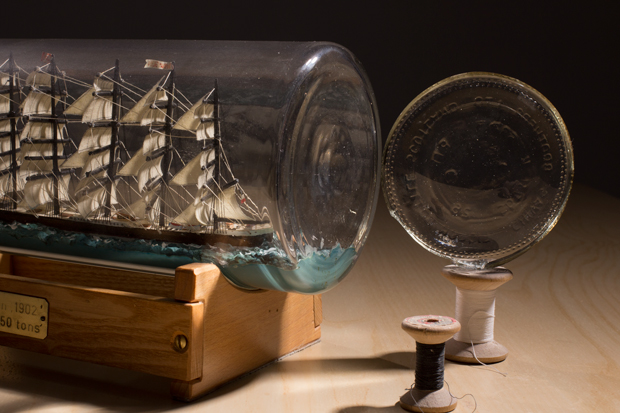
Where is `black wire`? The height and width of the screenshot is (413, 620). black wire is located at coordinates (426, 363).